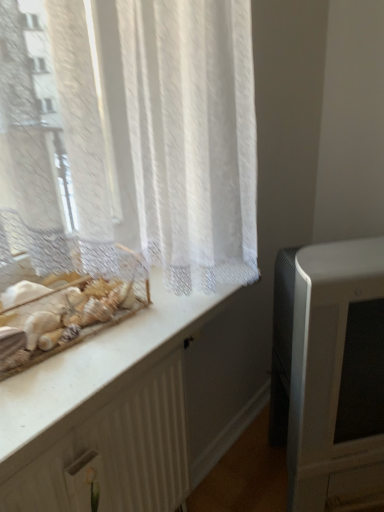
Image resolution: width=384 pixels, height=512 pixels. Find the location of `white marble counter at upper left`. white marble counter at upper left is located at coordinates (107, 411).

This screenshot has height=512, width=384. Describe the element at coordinates (107, 411) in the screenshot. I see `white marble counter at upper left` at that location.

Describe the element at coordinates (329, 371) in the screenshot. Image resolution: width=384 pixels, height=512 pixels. I see `matte white television at right` at that location.

Where is `white textured radiator at lower left`? white textured radiator at lower left is located at coordinates pyautogui.click(x=116, y=453).

From a real-world perspective, is white marble counter at upper left below matte white television at right?

No, from a real-world perspective, white marble counter at upper left is not under matte white television at right.

Which object is more forward, white marble counter at upper left or matte white television at right?

white marble counter at upper left is in front.

Identify the location of appliance that appears on the right of white marble counter at upper left. This screenshot has width=384, height=512. (329, 371).

From their relative heights in the image, would you say white marble counter at upper left is taller or shorter than matte white television at right?

Clearly, white marble counter at upper left is shorter compared to matte white television at right.

Identify the location of appliance above the white textured radiator at lower left (from the image's perspective). (329, 371).

How much distance is there between white textured radiator at lower left and matte white television at right?

white textured radiator at lower left and matte white television at right are 42.88 centimeters apart from each other.

From the picture: Can you confirm if white textured radiator at lower left is thinner than matte white television at right?

Indeed, white textured radiator at lower left has a lesser width compared to matte white television at right.

Who is taller, white textured radiator at lower left or matte white television at right?

Standing taller between the two is white textured radiator at lower left.

Which point is more distant from viewer, [141,418] or [99,424]?

The point [141,418] is farther.

Between white marble counter at upper left and white textured radiator at lower left, which one has less height?

white marble counter at upper left is shorter.

Identify the location of radiator below the white marble counter at upper left (from the image's perspective). Image resolution: width=384 pixels, height=512 pixels. (116, 453).

Is there a large distance between white marble counter at upper left and white textured radiator at lower left?

No.

Locate an element on the screen. The height and width of the screenshot is (512, 384). appliance behind the white marble counter at upper left is located at coordinates (329, 371).

Can you confirm if matte white television at right is smaller than white marble counter at upper left?

Incorrect, matte white television at right is not smaller in size than white marble counter at upper left.

Which object is further away from the camera, matte white television at right or white marble counter at upper left?

Positioned behind is matte white television at right.

Could white marble counter at upper left be considered to be inside white textured radiator at lower left?

Definitely not — white marble counter at upper left is not inside white textured radiator at lower left.

In terms of width, does white textured radiator at lower left look wider or thinner when compared to white marble counter at upper left?

Considering their sizes, white textured radiator at lower left looks slimmer than white marble counter at upper left.

Considering the positions of point (30, 480) and point (109, 398), is point (30, 480) closer or farther from the camera than point (109, 398)?

Point (30, 480) appears to be closer to the viewer than point (109, 398).

Are white textured radiator at lower left and white marble counter at upper left making contact?

Indeed, white textured radiator at lower left and white marble counter at upper left are beside each other and touching.

Is there a large distance between matte white television at right and white textured radiator at lower left?

No, matte white television at right is in close proximity to white textured radiator at lower left.

How different are the orientations of matte white television at right and white textured radiator at lower left in degrees?

matte white television at right and white textured radiator at lower left are facing 37.5 degrees away from each other.

Between matte white television at right and white textured radiator at lower left, which one appears on the right side from the viewer's perspective?

matte white television at right.

Which object is thinner, matte white television at right or white textured radiator at lower left?

white textured radiator at lower left.

The width and height of the screenshot is (384, 512). Find the location of `counter above the matte white television at right (from a real-world perspective)`. counter above the matte white television at right (from a real-world perspective) is located at coordinates (107, 411).

Locate an element on the screen. Image resolution: width=384 pixels, height=512 pixels. appliance below the white textured radiator at lower left (from a real-world perspective) is located at coordinates (329, 371).

Which object lies further to the anchor point white marble counter at upper left, matte white television at right or white textured radiator at lower left?

The object further to white marble counter at upper left is matte white television at right.

When comparing their distances from matte white television at right, does white marble counter at upper left or white textured radiator at lower left seem further?

white textured radiator at lower left is further to matte white television at right.

From the picture: When comparing their distances from matte white television at right, does white textured radiator at lower left or white marble counter at upper left seem closer?

Based on the image, white marble counter at upper left appears to be nearer to matte white television at right.

From the image, which object appears to be nearer to white textured radiator at lower left, matte white television at right or white marble counter at upper left?

white marble counter at upper left is positioned closer to the anchor white textured radiator at lower left.

From the image, which object appears to be farther from white marble counter at upper left, white textured radiator at lower left or matte white television at right?

matte white television at right lies further to white marble counter at upper left than the other object.

Based on their spatial positions, is white marble counter at upper left or matte white television at right closer to white textured radiator at lower left?

white marble counter at upper left is positioned closer to the anchor white textured radiator at lower left.

This screenshot has width=384, height=512. I want to click on radiator between white marble counter at upper left and matte white television at right from left to right, so click(x=116, y=453).